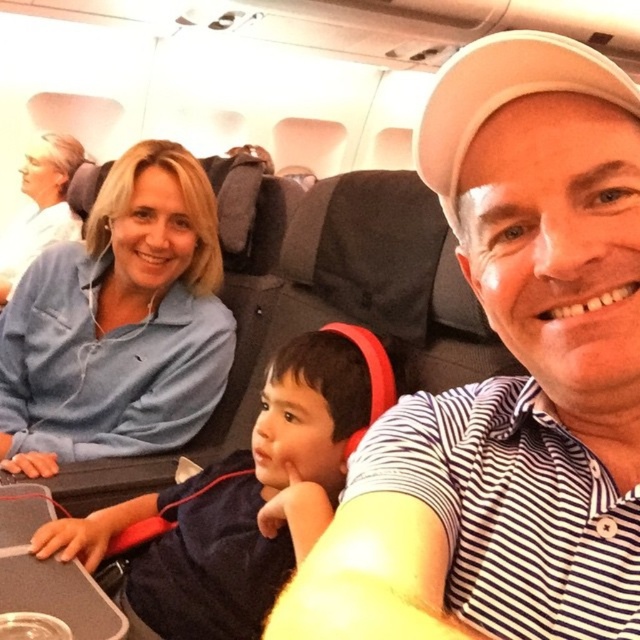
Question: Observing the image, what is the correct spatial positioning of blue cotton shirt at upper left in reference to dark blue fabric at center?

Choices:
 (A) below
 (B) above

Answer: (B)

Question: Does white striped polo shirt at center appear on the left side of blue cotton shirt at upper left?

Choices:
 (A) no
 (B) yes

Answer: (A)

Question: Which of the following is the farthest from the observer?

Choices:
 (A) (147, 548)
 (B) (570, 234)
 (C) (104, 256)

Answer: (C)

Question: Which point is farther to the camera?

Choices:
 (A) blue cotton shirt at upper left
 (B) white striped polo shirt at center

Answer: (A)

Question: Which point appears farthest from the camera in this image?

Choices:
 (A) [490, 193]
 (B) [179, 420]

Answer: (B)

Question: Is white striped polo shirt at center to the right of blue cotton shirt at upper left from the viewer's perspective?

Choices:
 (A) no
 (B) yes

Answer: (B)